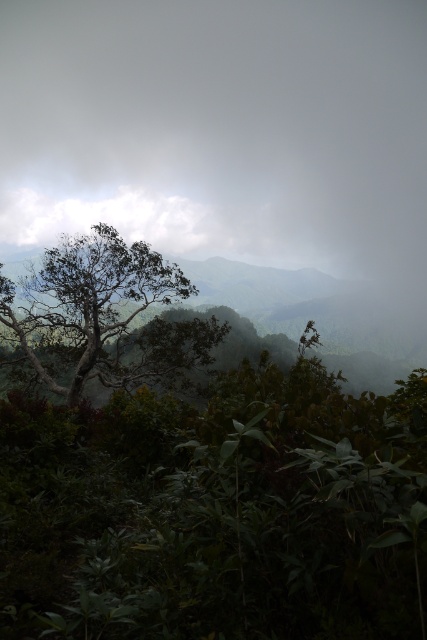
You are a hiker standing at the base of the green matte tree at center. You want to take a photo of the white fluffy cloud at upper left. Which direction should you move to get the cloud in your frame?

The green matte tree at center is closer to the viewer than the white fluffy cloud at upper left. To capture the white fluffy cloud at upper left in your photo, you should move away from the green matte tree at center to get a better view of the cloud.

You are a hiker who wants to take a photo of the green matte tree at center and the white fluffy cloud at upper left. Which object is closer to the camera, and why?

The green matte tree at center is closer to the camera because it has a lesser height compared to the white fluffy cloud at upper left, meaning it appears lower in the frame.